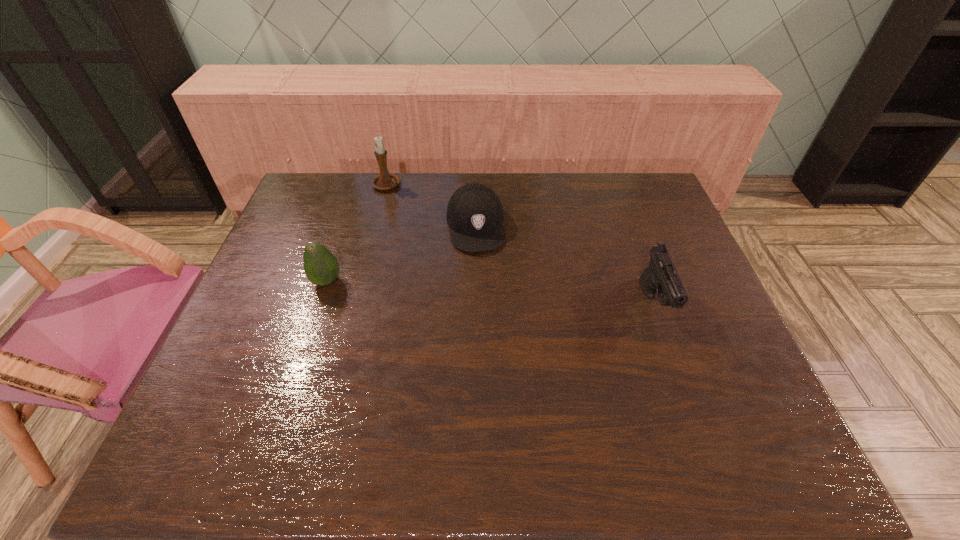
This screenshot has width=960, height=540. Find the location of `free region at the left edge of the desktop`. free region at the left edge of the desktop is located at coordinates (230, 332).

Find the location of a particular element. This screenshot has width=960, height=540. vacant region at the right edge of the desktop is located at coordinates [655, 310].

Locate an element on the screen. The width and height of the screenshot is (960, 540). free space at the far left corner of the desktop is located at coordinates (303, 212).

The image size is (960, 540). In order to click on blank space at the far right corner of the desktop in this screenshot , I will do `click(645, 205)`.

At what (x,y) coordinates should I click in order to perform the action: click on free space between the second farthest object and the avocado. Please return your answer as a coordinate pair (x, y). Image resolution: width=960 pixels, height=540 pixels. Looking at the image, I should click on (401, 254).

This screenshot has width=960, height=540. Identify the location of vacant space in between the rightmost object and the cap. (565, 265).

You are a GUI agent. You are given a task and a screenshot of the screen. Output one action in this format:
    pyautogui.click(x=<x>, y=<y>)
    Task: Click on the free space between the second farthest object and the rightmost object
    The width and height of the screenshot is (960, 540).
    Given the screenshot: What is the action you would take?
    pyautogui.click(x=565, y=265)

Find the location of a particular element. vacant area between the pistol and the second object from left to right is located at coordinates (520, 245).

Identify the location of vacant space that is in between the pistol and the third object from left to right. Image resolution: width=960 pixels, height=540 pixels. (565, 265).

Identify the location of vacant space that's between the cap and the third object from right to left. The image size is (960, 540). (431, 206).